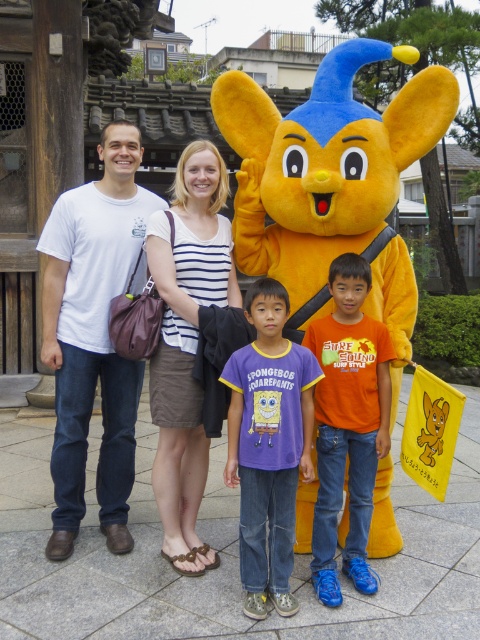
Is yellow plush mascot at center above white striped shirt at center?

Yes.

Is the position of yellow plush mascot at center less distant than that of white striped shirt at center?

Yes, it is in front of white striped shirt at center.

Image resolution: width=480 pixels, height=640 pixels. I want to click on yellow plush mascot at center, so click(331, 184).

Describe the element at coordinates (331, 184) in the screenshot. I see `yellow plush mascot at center` at that location.

At what (x,y) coordinates should I click in order to perform the action: click on yellow plush mascot at center. Please return your answer as a coordinate pair (x, y). Image resolution: width=480 pixels, height=640 pixels. Looking at the image, I should click on (331, 184).

How far apart are white cotton t-shirt at left and purple cotton shirt at center?

white cotton t-shirt at left and purple cotton shirt at center are 33.48 inches apart from each other.

Is white cotton t-shirt at left further to camera compared to purple cotton shirt at center?

Yes.

Does point (135, 387) come in front of point (294, 483)?

No.

This screenshot has width=480, height=640. I want to click on white cotton t-shirt at left, so [94, 337].